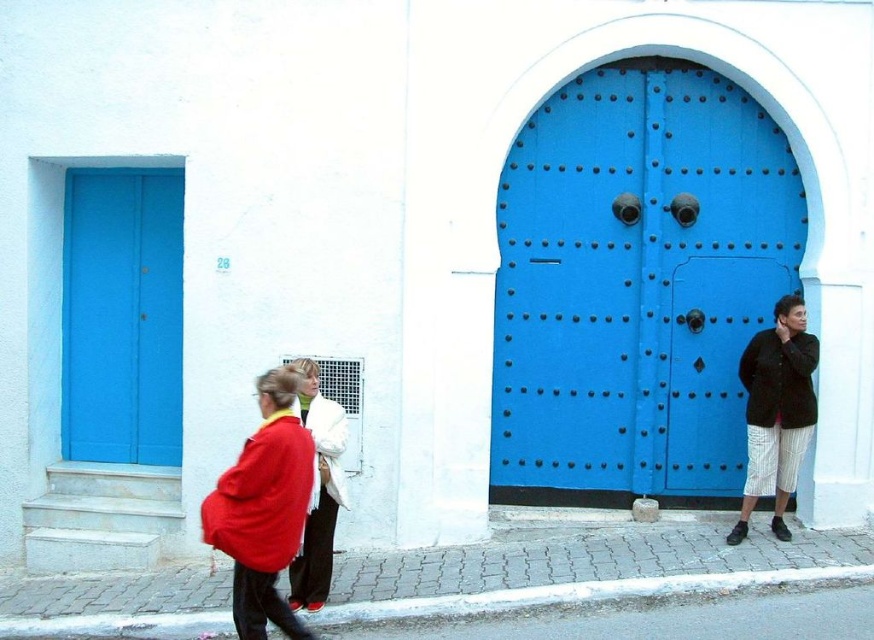
Is matte red coat at center shorter than dark brown cotton sweatshirt at right?

No.

Is point (340, 442) less distant than point (771, 372)?

That is True.

Between point (327, 563) and point (812, 356), which one is positioned behind?

The point (812, 356) is more distant.

The width and height of the screenshot is (874, 640). Find the location of `matte red coat at center`. matte red coat at center is located at coordinates (317, 490).

Locate an element on the screen. Image resolution: width=874 pixels, height=640 pixels. blue painted wood door at center is located at coordinates (635, 284).

I want to click on blue painted wood door at center, so click(635, 284).

Find the location of a particular element. Image resolution: width=874 pixels, height=640 pixels. blue painted wood door at center is located at coordinates (635, 284).

Is black textured jacket at right wider than dark brown cotton sweatshirt at right?

Yes, black textured jacket at right is wider than dark brown cotton sweatshirt at right.

Does black textured jacket at right appear under dark brown cotton sweatshirt at right?

Correct, black textured jacket at right is located below dark brown cotton sweatshirt at right.

Image resolution: width=874 pixels, height=640 pixels. Identify the location of black textured jacket at right. (775, 412).